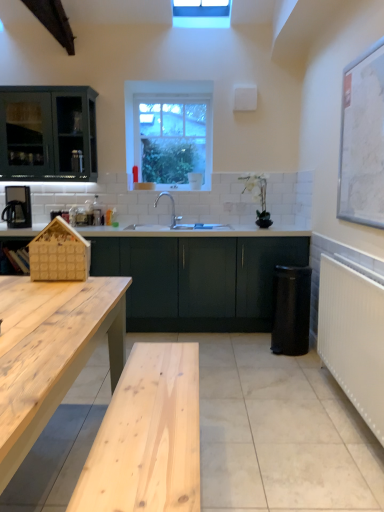
Where is `free spot in front of wooden house at left`? free spot in front of wooden house at left is located at coordinates (59, 285).